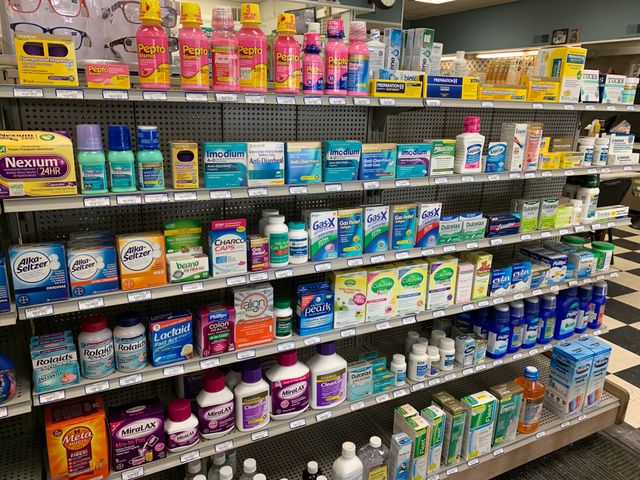
Identify the location of the top shelf. The width and height of the screenshot is (640, 480). (93, 94), (461, 105), (600, 105).